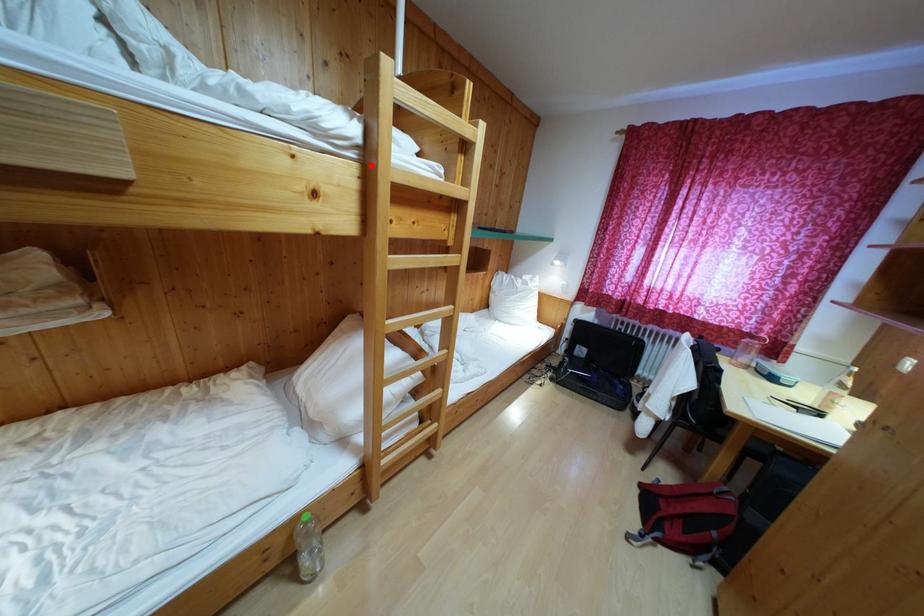
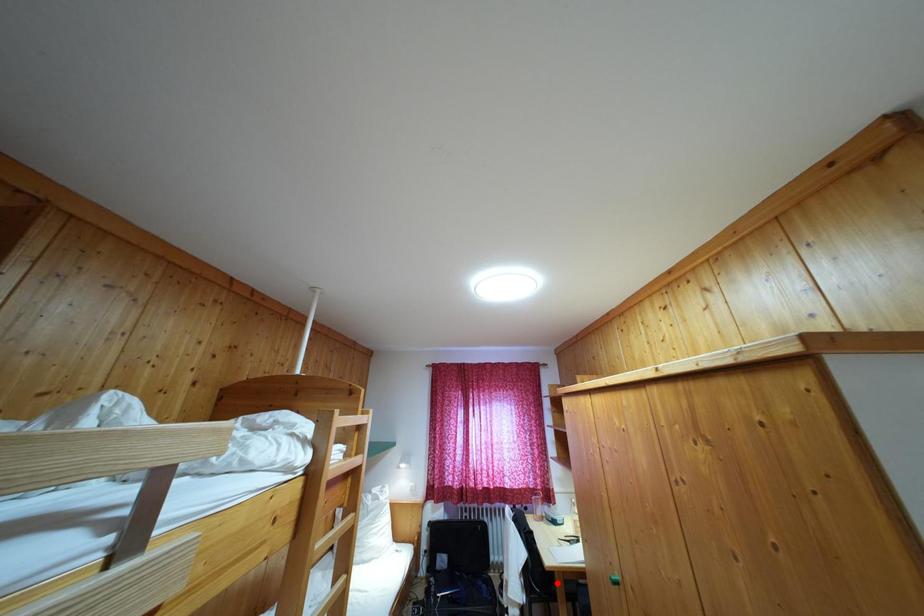
I am providing you with two images of the same scene from different viewpoints. A red point is marked on the first image and another point is marked on the second image. Does the point marked in image1 correspond to the same location as the one in image2?

No